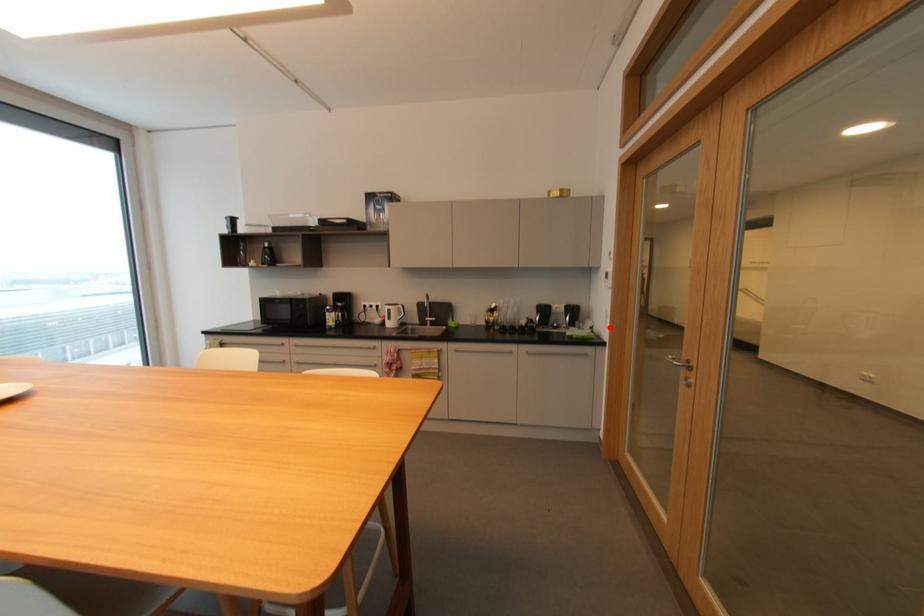
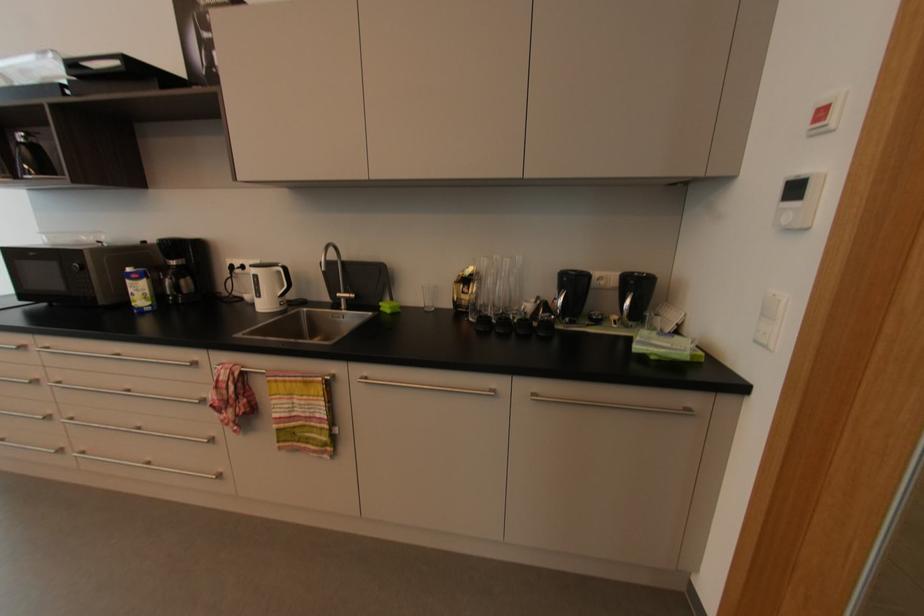
In the second image, find the point that corresponds to the highlighted location in the first image.

(769, 347)